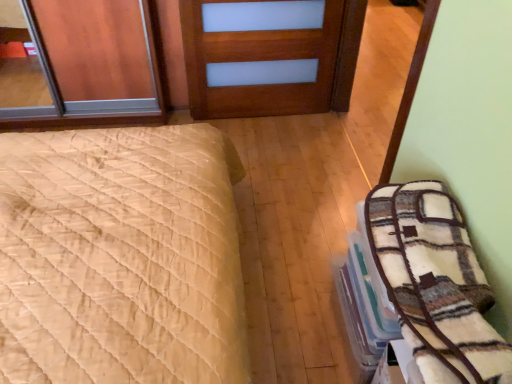
Question: Choose the correct answer: Is plush white blanket at right inside beige quilted bed at left or outside it?

Choices:
 (A) inside
 (B) outside

Answer: (B)

Question: From a real-world perspective, relative to beige quilted bed at left, is plush white blanket at right vertically above or below?

Choices:
 (A) below
 (B) above

Answer: (B)

Question: Considering the real-world distances, which object is closest to the plush white blanket at right?

Choices:
 (A) wooden door at center
 (B) beige quilted bed at left

Answer: (B)

Question: Estimate the real-world distances between objects in this image. Which object is farther from the beige quilted bed at left?

Choices:
 (A) plush white blanket at right
 (B) wooden door at center

Answer: (B)